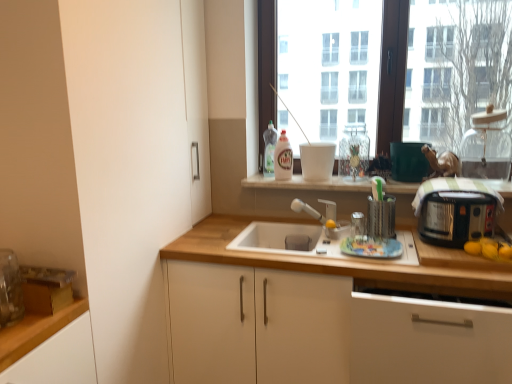
Find the location of a particular element. The width and height of the screenshot is (512, 384). free space above white matte cabinet at center, the first cabinetry positioned from the left (from a real-world perspective) is located at coordinates (304, 236).